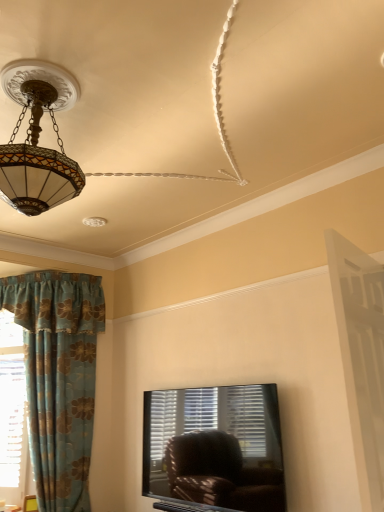
Question: From the image's perspective, is tiffany glass pendant light at upper left positioned above or below matte glass chandelier at upper left?

Choices:
 (A) above
 (B) below

Answer: (B)

Question: Is tiffany glass pendant light at upper left in front of or behind matte glass chandelier at upper left in the image?

Choices:
 (A) behind
 (B) front

Answer: (A)

Question: Estimate the real-world distances between objects in this image. Which object is closer to the white wooden screen door at right?

Choices:
 (A) tiffany glass pendant light at upper left
 (B) matte glass chandelier at upper left
 (C) blue floral fabric curtain at left

Answer: (A)

Question: Based on their relative distances, which object is nearer to the tiffany glass pendant light at upper left?

Choices:
 (A) white wooden screen door at right
 (B) blue floral fabric curtain at left
 (C) matte glass chandelier at upper left

Answer: (C)